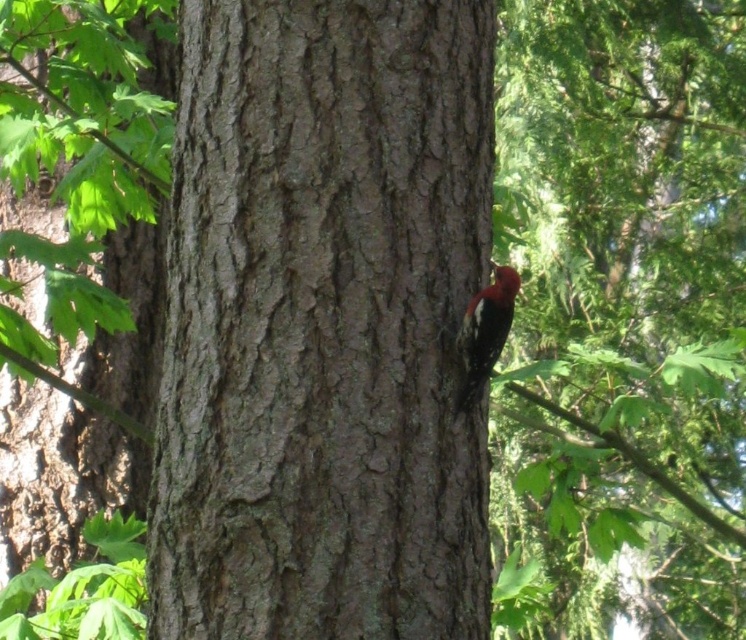
Question: Does smooth bark tree trunk at center appear on the right side of reddish-brown woodpecker at right?

Choices:
 (A) yes
 (B) no

Answer: (B)

Question: Which of the following is the farthest from the observer?

Choices:
 (A) (433, 44)
 (B) (468, 340)

Answer: (B)

Question: Does smooth bark tree trunk at center have a larger size compared to reddish-brown woodpecker at right?

Choices:
 (A) no
 (B) yes

Answer: (B)

Question: Where is smooth bark tree trunk at center located in relation to reddish-brown woodpecker at right in the image?

Choices:
 (A) above
 (B) below

Answer: (A)

Question: Among these points, which one is nearest to the camera?

Choices:
 (A) (286, 58)
 (B) (498, 301)

Answer: (A)

Question: Which of the following is the closest to the observer?

Choices:
 (A) smooth bark tree trunk at center
 (B) reddish-brown woodpecker at right

Answer: (A)